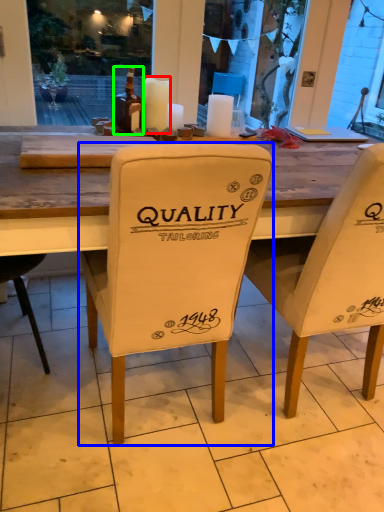
Question: Estimate the real-world distances between objects in this image. Which object is closer to candle (highlighted by a red box), chair (highlighted by a blue box) or bottle (highlighted by a green box)?

Choices:
 (A) chair
 (B) bottle

Answer: (B)